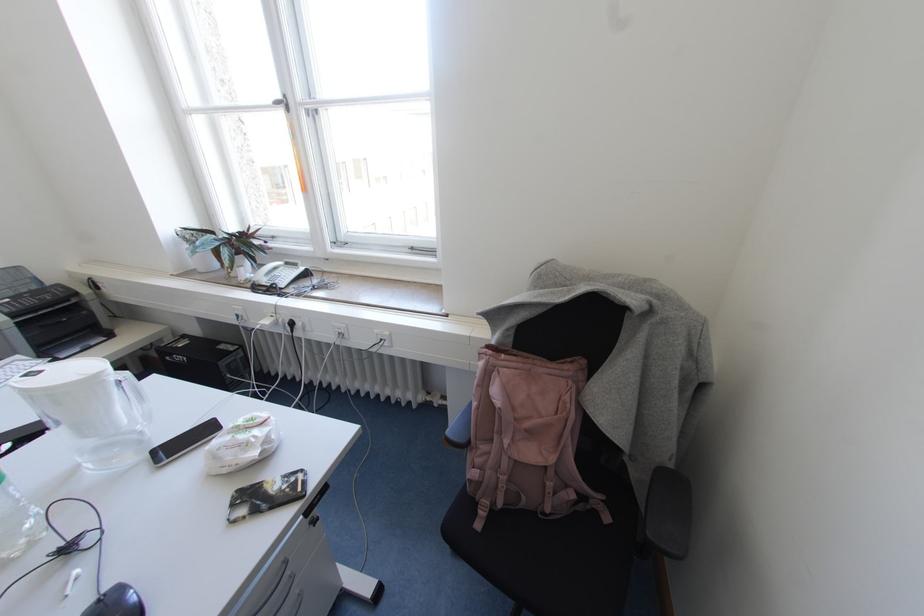
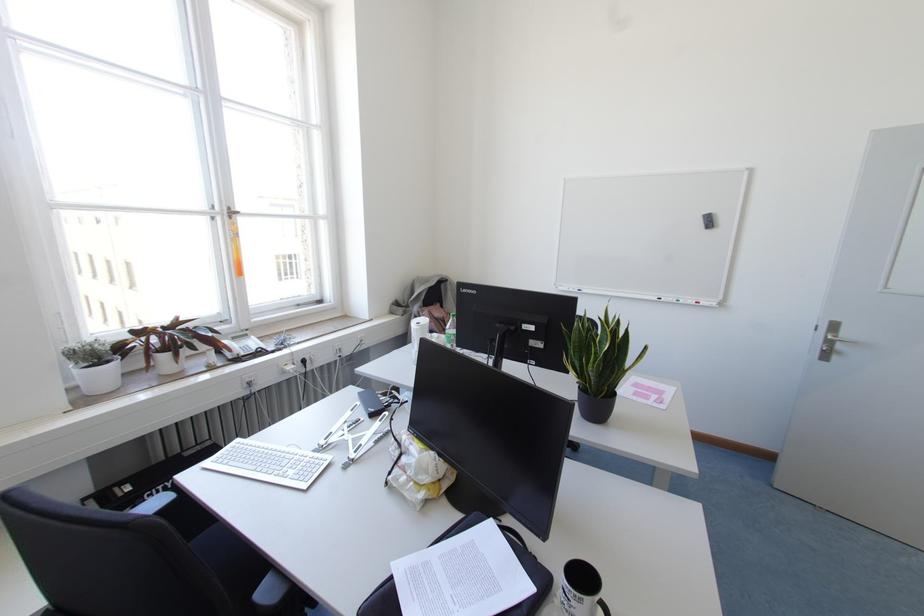
Question: I am providing you with two images of the same scene from different viewpoints. Which of the following objects are not visible in image2?

Choices:
 (A) white plant pot
 (B) blue whiteboard marker
 (C) white water bottle
 (D) none of these

Answer: (D)